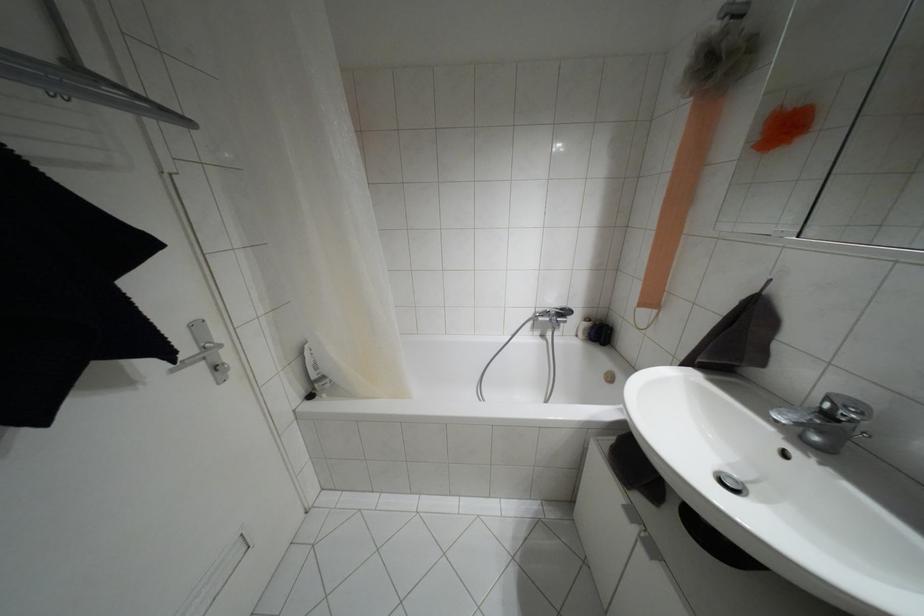
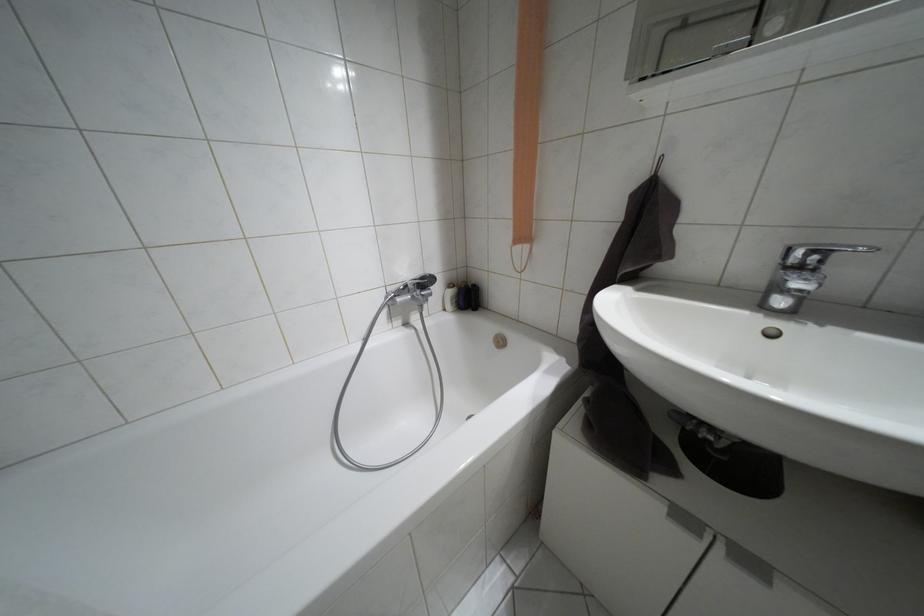
Where in the second image is the point corresponding to the point at 586,318 from the first image?

(448, 285)